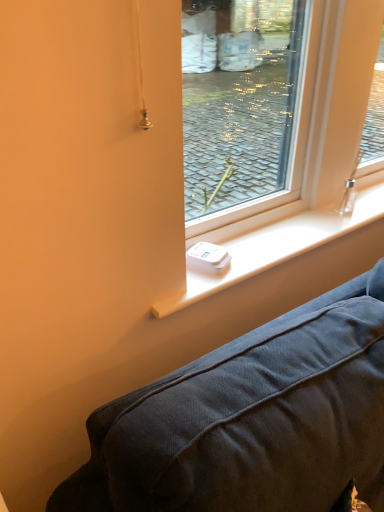
Question: Considering the positions of point (208, 281) and point (317, 150), is point (208, 281) closer or farther from the camera than point (317, 150)?

Choices:
 (A) farther
 (B) closer

Answer: (B)

Question: From the image's perspective, relative to transparent glass window at center, is white plastic device at center above or below?

Choices:
 (A) below
 (B) above

Answer: (A)

Question: In terms of width, does white plastic device at center look wider or thinner when compared to transparent glass window at center?

Choices:
 (A) thin
 (B) wide

Answer: (B)

Question: From the image's perspective, is transparent glass window at center above or below white plastic device at center?

Choices:
 (A) above
 (B) below

Answer: (A)

Question: Is transparent glass window at center in front of or behind white plastic device at center in the image?

Choices:
 (A) behind
 (B) front

Answer: (B)

Question: From a real-world perspective, is transparent glass window at center physically located above or below white plastic device at center?

Choices:
 (A) above
 (B) below

Answer: (A)

Question: Considering the positions of point (342, 232) and point (271, 226), is point (342, 232) closer or farther from the camera than point (271, 226)?

Choices:
 (A) farther
 (B) closer

Answer: (A)